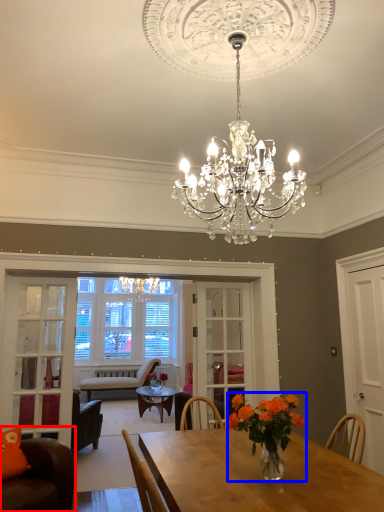
Question: Which object is closer to the camera taking this photo, chair (highlighted by a red box) or floral arrangement (highlighted by a blue box)?

Choices:
 (A) chair
 (B) floral arrangement

Answer: (B)